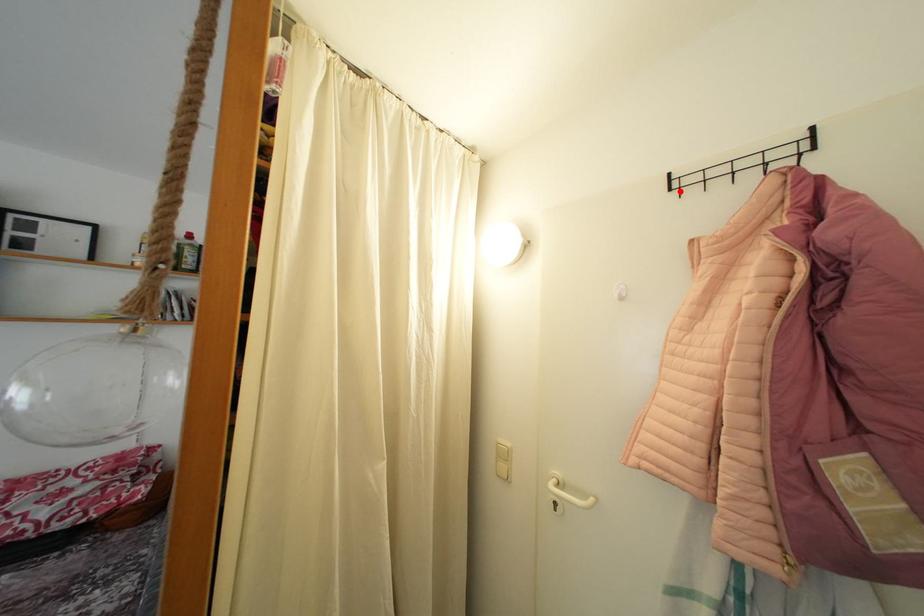
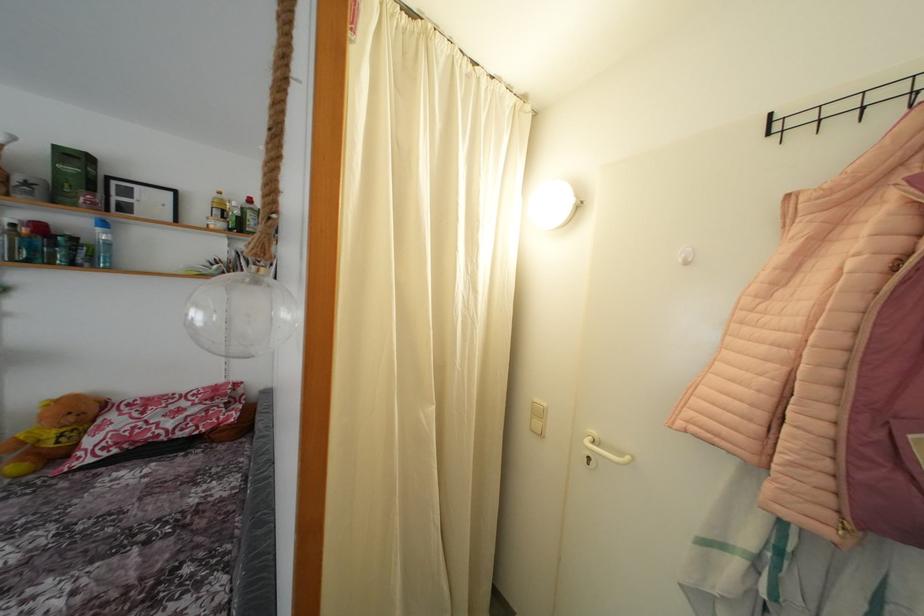
The point at the highlighted location is marked in the first image. Where is the corresponding point in the second image?

(782, 134)